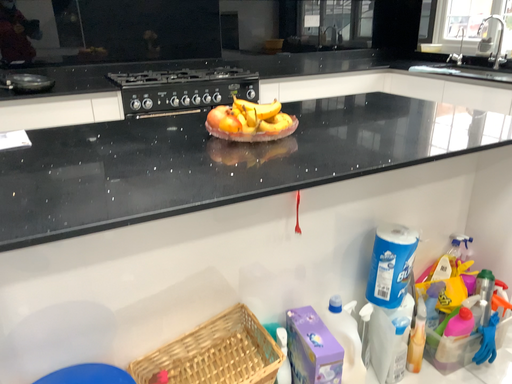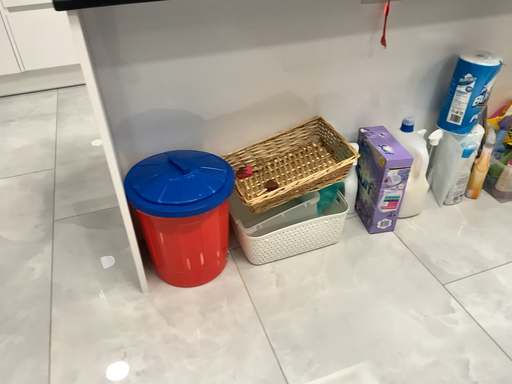
Question: How did the camera likely rotate when shooting the video?

Choices:
 (A) rotated upward
 (B) rotated downward

Answer: (B)